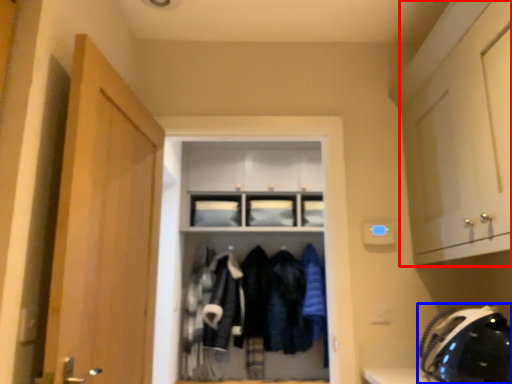
Question: Which point is further to the camera, cabinetry (highlighted by a red box) or helmet (highlighted by a blue box)?

Choices:
 (A) cabinetry
 (B) helmet

Answer: (B)